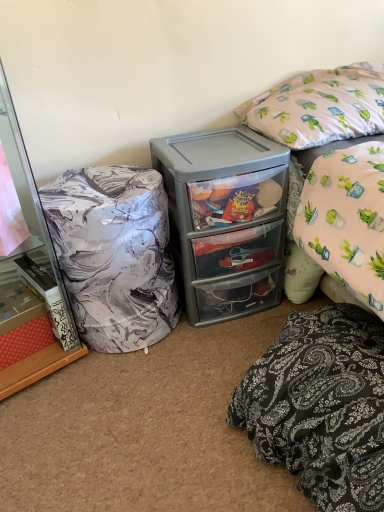
Question: Can you confirm if gray plastic storage at center is positioned to the left of pink fabric pillow at upper right, acting as the 1th pillow starting from the top?

Choices:
 (A) yes
 (B) no

Answer: (A)

Question: Is gray plastic storage at center in front of pink fabric pillow at upper right, acting as the 1th pillow starting from the top?

Choices:
 (A) yes
 (B) no

Answer: (B)

Question: Is gray plastic storage at center aimed at pink fabric pillow at upper right, acting as the 1th pillow starting from the top?

Choices:
 (A) yes
 (B) no

Answer: (B)

Question: Does gray plastic storage at center have a lesser height compared to pink fabric pillow at upper right, the second pillow in the bottom-to-top sequence?

Choices:
 (A) yes
 (B) no

Answer: (B)

Question: Is there a large distance between gray plastic storage at center and pink fabric pillow at upper right, acting as the 1th pillow starting from the top?

Choices:
 (A) yes
 (B) no

Answer: (B)

Question: Considering the positions of black paisley pillow at lower right, the 2th pillow when ordered from top to bottom, and gray plastic storage at center in the image, is black paisley pillow at lower right, the 2th pillow when ordered from top to bottom, taller or shorter than gray plastic storage at center?

Choices:
 (A) tall
 (B) short

Answer: (B)

Question: From the image's perspective, is black paisley pillow at lower right, the 2th pillow when ordered from top to bottom, positioned above or below gray plastic storage at center?

Choices:
 (A) above
 (B) below

Answer: (B)

Question: Is black paisley pillow at lower right, which is the 1th pillow from bottom to top, bigger or smaller than gray plastic storage at center?

Choices:
 (A) small
 (B) big

Answer: (A)

Question: Considering the positions of black paisley pillow at lower right, the 2th pillow when ordered from top to bottom, and gray plastic storage at center in the image, is black paisley pillow at lower right, the 2th pillow when ordered from top to bottom, wider or thinner than gray plastic storage at center?

Choices:
 (A) thin
 (B) wide

Answer: (B)

Question: Based on their positions, is marble-patterned fabric at left located to the left or right of pink fabric pillow at upper right, acting as the 1th pillow starting from the top?

Choices:
 (A) right
 (B) left

Answer: (B)

Question: From the image's perspective, is marble-patterned fabric at left positioned above or below pink fabric pillow at upper right, acting as the 1th pillow starting from the top?

Choices:
 (A) below
 (B) above

Answer: (A)

Question: Considering their positions, is marble-patterned fabric at left located in front of or behind pink fabric pillow at upper right, acting as the 1th pillow starting from the top?

Choices:
 (A) front
 (B) behind

Answer: (A)

Question: From their relative heights in the image, would you say marble-patterned fabric at left is taller or shorter than pink fabric pillow at upper right, acting as the 1th pillow starting from the top?

Choices:
 (A) short
 (B) tall

Answer: (B)

Question: Is point (372, 461) closer or farther from the camera than point (306, 78)?

Choices:
 (A) closer
 (B) farther

Answer: (A)

Question: From their relative heights in the image, would you say black paisley pillow at lower right, which is the 1th pillow from bottom to top, is taller or shorter than pink fabric pillow at upper right, acting as the 1th pillow starting from the top?

Choices:
 (A) tall
 (B) short

Answer: (A)